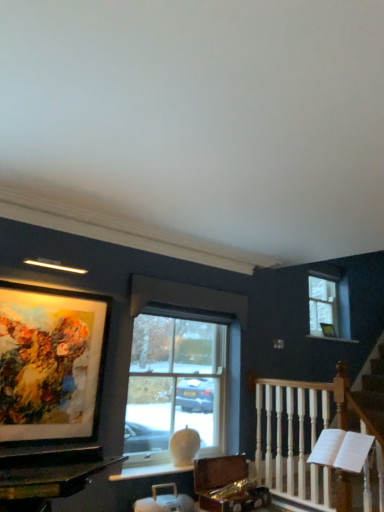
Question: Can you confirm if matte glass picture frame at upper left is bigger than clear glass window at upper right, which is the first window in right-to-left order?

Choices:
 (A) yes
 (B) no

Answer: (A)

Question: Considering the relative sizes of matte glass picture frame at upper left and clear glass window at upper right, which is the first window from back to front, in the image provided, is matte glass picture frame at upper left shorter than clear glass window at upper right, which is the first window from back to front,?

Choices:
 (A) no
 (B) yes

Answer: (A)

Question: Is matte glass picture frame at upper left facing away from clear glass window at upper right, which is the first window from back to front?

Choices:
 (A) yes
 (B) no

Answer: (B)

Question: From the image's perspective, is matte glass picture frame at upper left on clear glass window at upper right, the 2th window positioned from the left?

Choices:
 (A) yes
 (B) no

Answer: (B)

Question: Can you confirm if matte glass picture frame at upper left is smaller than clear glass window at upper right, which is the first window in right-to-left order?

Choices:
 (A) yes
 (B) no

Answer: (B)

Question: From a real-world perspective, is white wooden railing at right positioned above or below clear glass window at center, the 2th window viewed from the back?

Choices:
 (A) below
 (B) above

Answer: (A)

Question: Is white wooden railing at right in front of or behind clear glass window at center, the 2th window viewed from the back, in the image?

Choices:
 (A) behind
 (B) front

Answer: (B)

Question: Is white wooden railing at right bigger or smaller than clear glass window at center, which is the 2th window from right to left?

Choices:
 (A) small
 (B) big

Answer: (B)

Question: Considering the positions of point (292, 430) and point (157, 329), is point (292, 430) closer or farther from the camera than point (157, 329)?

Choices:
 (A) closer
 (B) farther

Answer: (A)

Question: Considering their positions, is clear glass window at center, acting as the 1th window starting from the front, located in front of or behind clear glass window at upper right, the 2th window positioned from the left?

Choices:
 (A) front
 (B) behind

Answer: (A)

Question: Is clear glass window at center, which is counted as the 1th window, starting from the left, spatially inside clear glass window at upper right, the 2th window viewed from the front, or outside of it?

Choices:
 (A) inside
 (B) outside

Answer: (B)

Question: Would you say clear glass window at center, the 2th window viewed from the back, is to the left or to the right of clear glass window at upper right, the 2th window viewed from the front, in the picture?

Choices:
 (A) right
 (B) left

Answer: (B)

Question: Is point pos(208,374) positioned closer to the camera than point pos(331,334)?

Choices:
 (A) farther
 (B) closer

Answer: (B)

Question: Considering the positions of white marble window sill at upper center and matte glass picture frame at upper left in the image, is white marble window sill at upper center wider or thinner than matte glass picture frame at upper left?

Choices:
 (A) wide
 (B) thin

Answer: (A)

Question: Visually, is white marble window sill at upper center positioned to the left or to the right of matte glass picture frame at upper left?

Choices:
 (A) left
 (B) right

Answer: (B)